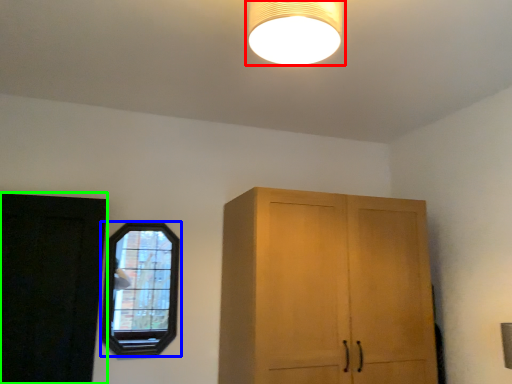
Question: Which object is the closest to the lamp (highlighted by a red box)? Choose among these: window (highlighted by a blue box) or door (highlighted by a green box).

Choices:
 (A) window
 (B) door

Answer: (A)